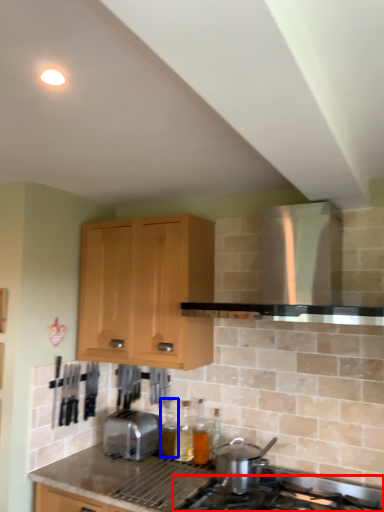
Question: Which object is further to the camera taking this photo, gas stove (highlighted by a red box) or bottle (highlighted by a blue box)?

Choices:
 (A) gas stove
 (B) bottle

Answer: (B)